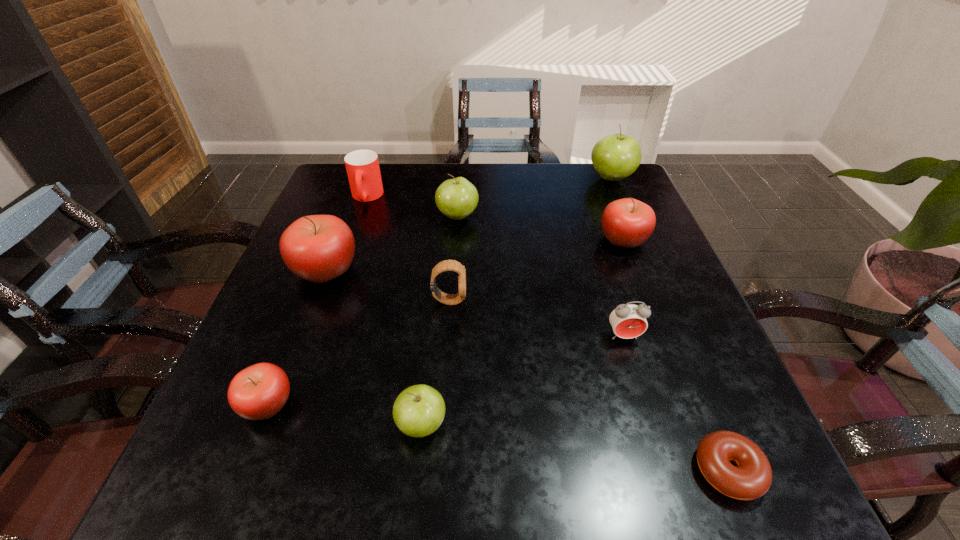
Identify which green apple is the nearest to the smallest green apple. Please provide its 2D coordinates. Your answer should be formatted as a tuple, i.e. [(x, y)], where the tuple contains the x and y coordinates of a point satisfying the conditions above.

[(457, 198)]

Where is `red apple that stands as the closest to the nearest red apple`? The image size is (960, 540). red apple that stands as the closest to the nearest red apple is located at coordinates (318, 248).

Locate which red apple is the closest to the nearest red apple. Please provide its 2D coordinates. Your answer should be formatted as a tuple, i.e. [(x, y)], where the tuple contains the x and y coordinates of a point satisfying the conditions above.

[(318, 248)]

Identify the location of vacant point that satisfies the following two spatial constraints: 1. on the face of the chocolate doughnut; 2. on the left side of the watch. Image resolution: width=960 pixels, height=540 pixels. pyautogui.click(x=438, y=470).

Where is `free space that satisfies the following two spatial constraints: 1. on the face of the shortest object; 2. on the left side of the red alarm clock`? The image size is (960, 540). free space that satisfies the following two spatial constraints: 1. on the face of the shortest object; 2. on the left side of the red alarm clock is located at coordinates click(664, 470).